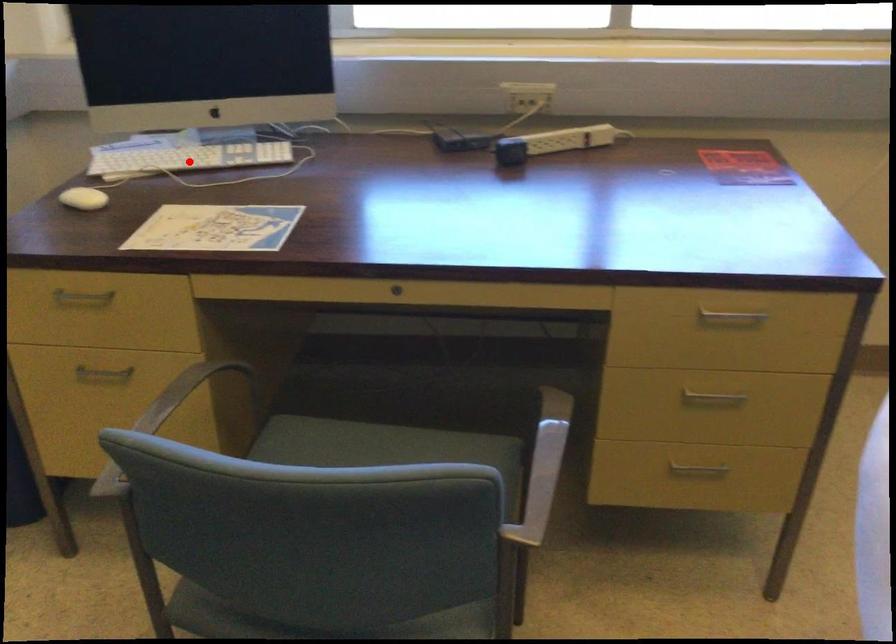
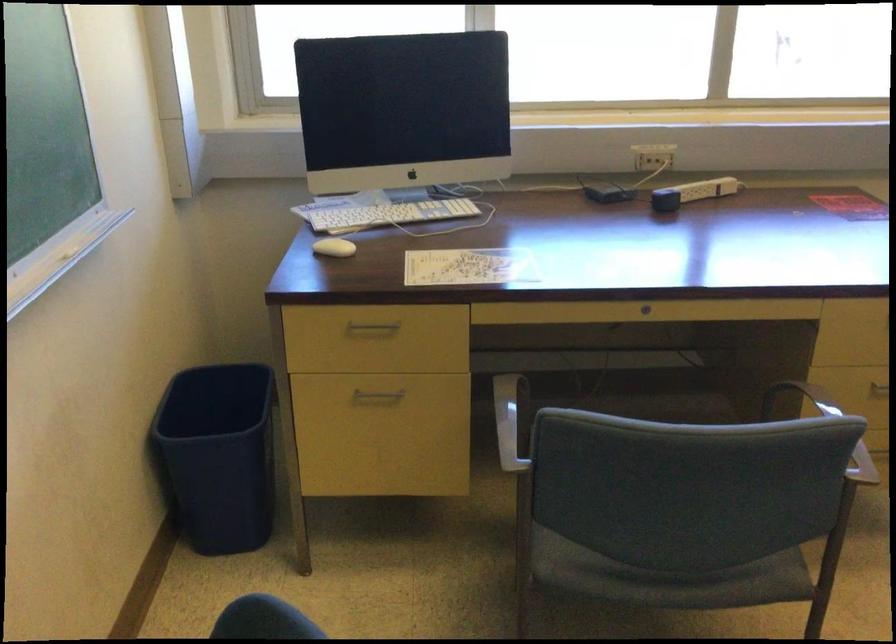
Question: I am providing you with two images of the same scene from different viewpoints. Image1 has a red point marked. In image2, the corresponding 3D location appears at what relative position? Reply with the corresponding letter.

Choices:
 (A) Closer
 (B) Farther

Answer: (B)